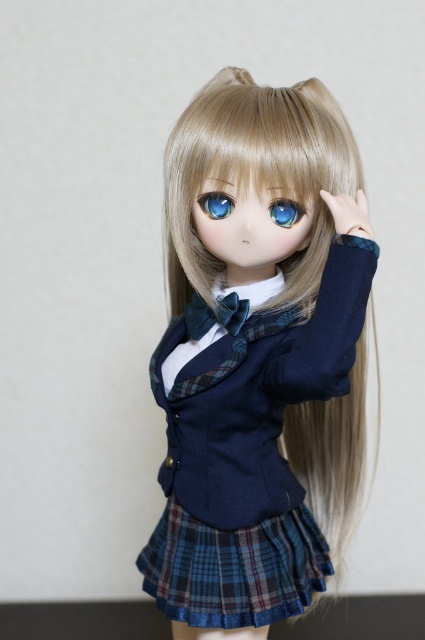
Looking at this image, does matte blue uniform at center lie behind navy blue fabric jacket at center?

Yes, it is behind navy blue fabric jacket at center.

Which is below, matte blue uniform at center or navy blue fabric jacket at center?

Positioned lower is matte blue uniform at center.

Between point (265, 444) and point (226, 506), which one is positioned behind?

Positioned behind is point (265, 444).

Where is `matte blue uniform at center`? The image size is (425, 640). matte blue uniform at center is located at coordinates (258, 356).

Is matte blue uniform at center positioned in front of blue glossy eye at center?

Yes, matte blue uniform at center is in front of blue glossy eye at center.

Is matte blue uniform at center wider than blue glossy eye at center?

Yes.

Which is in front, point (320, 241) or point (217, 204)?

Point (217, 204)

You are a GUI agent. You are given a task and a screenshot of the screen. Output one action in this format:
    pyautogui.click(x=<x>, y=<y>)
    Task: Click on the matte blue uniform at center
    The height and width of the screenshot is (640, 425).
    Given the screenshot: What is the action you would take?
    pyautogui.click(x=258, y=356)

Which of these two, blonde silky hair at center or blue glossy eye at center, stands shorter?

blue glossy eye at center

Does blonde silky hair at center lie behind blue glossy eye at center?

No.

Who is more distant from viewer, (314, 234) or (221, 212)?

The point (314, 234) is behind.

Identify the location of blonde silky hair at center. (255, 173).